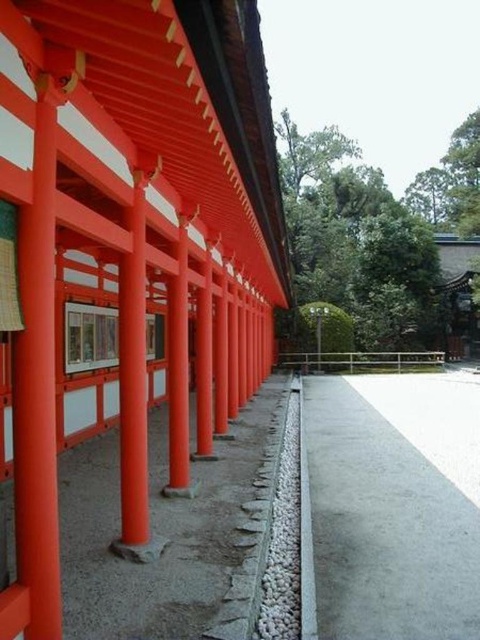
Question: Which point is closer to the camera?

Choices:
 (A) matte orange pillars at center
 (B) matte orange post at upper left
 (C) gray concrete path at lower center

Answer: (A)

Question: Where is matte orange pillars at center located in relation to matte orange post at upper left in the image?

Choices:
 (A) below
 (B) above

Answer: (B)

Question: In this image, where is matte orange pillars at center located relative to gray concrete path at lower center?

Choices:
 (A) right
 (B) left

Answer: (B)

Question: Which object is positioned closest to the matte orange pillars at center?

Choices:
 (A) matte orange post at upper left
 (B) gray concrete path at lower center

Answer: (B)

Question: Based on their relative distances, which object is nearer to the matte orange pillars at center?

Choices:
 (A) gray concrete path at lower center
 (B) matte orange post at center

Answer: (B)

Question: Does matte orange post at upper left appear on the left side of matte orange post at center?

Choices:
 (A) yes
 (B) no

Answer: (A)